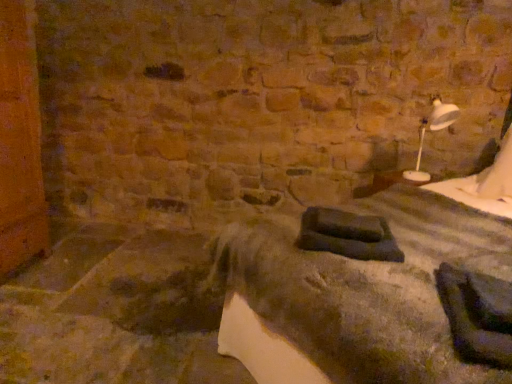
Locate an element on the screen. The height and width of the screenshot is (384, 512). dark gray fabric bed at center is located at coordinates (377, 287).

What do you see at coordinates (377, 287) in the screenshot? I see `dark gray fabric bed at center` at bounding box center [377, 287].

What do you see at coordinates (432, 130) in the screenshot?
I see `white plastic lamp at upper right` at bounding box center [432, 130].

Identify the location of white plastic lamp at upper right. This screenshot has width=512, height=384. (432, 130).

Where is `dark gray fabric bed at center`? The image size is (512, 384). dark gray fabric bed at center is located at coordinates (377, 287).

Is dark gray fabric bed at center at the left side of white plastic lamp at upper right?

Yes.

Between dark gray fabric bed at center and white plastic lamp at upper right, which one is positioned behind?

white plastic lamp at upper right is behind.

Which point is more distant from viewer, (x=274, y=305) or (x=443, y=128)?

The point (x=443, y=128) is farther from the camera.

From the image's perspective, which is above, dark gray fabric bed at center or white plastic lamp at upper right?

white plastic lamp at upper right, from the image's perspective.

From a real-world perspective, is dark gray fabric bed at center positioned under white plastic lamp at upper right based on gravity?

Yes, from a real-world perspective, dark gray fabric bed at center is beneath white plastic lamp at upper right.

Which object is wider, dark gray fabric bed at center or white plastic lamp at upper right?

dark gray fabric bed at center.

Is dark gray fabric bed at center taller or shorter than white plastic lamp at upper right?

In the image, dark gray fabric bed at center appears to be taller than white plastic lamp at upper right.

Which of these two, dark gray fabric bed at center or white plastic lamp at upper right, is bigger?

dark gray fabric bed at center is bigger.

Is dark gray fabric bed at center outside of white plastic lamp at upper right?

Yes.

Are dark gray fabric bed at center and white plastic lamp at upper right beside each other?

dark gray fabric bed at center and white plastic lamp at upper right are clearly separated.

Is dark gray fabric bed at center oriented towards white plastic lamp at upper right?

No.

How different are the orientations of dark gray fabric bed at center and white plastic lamp at upper right in degrees?

There is a 50-degree angle between the facing directions of dark gray fabric bed at center and white plastic lamp at upper right.

Find the location of a particular element. The height and width of the screenshot is (384, 512). bedside lamp that appears behind the dark gray fabric bed at center is located at coordinates (432, 130).

Considering the relative positions of white plastic lamp at upper right and dark gray fabric bed at center in the image provided, is white plastic lamp at upper right to the right of dark gray fabric bed at center from the viewer's perspective?

Correct, you'll find white plastic lamp at upper right to the right of dark gray fabric bed at center.

Which object is closer to the camera taking this photo, white plastic lamp at upper right or dark gray fabric bed at center?

dark gray fabric bed at center is closer to the camera.

Which is more distant, (405, 172) or (465, 256)?

The point (405, 172) is farther from the camera.

From the image's perspective, is white plastic lamp at upper right located above dark gray fabric bed at center?

Yes, from the image's perspective, white plastic lamp at upper right is above dark gray fabric bed at center.

From a real-world perspective, is white plastic lamp at upper right positioned above or below dark gray fabric bed at center?

In terms of real-world spatial position, white plastic lamp at upper right is above dark gray fabric bed at center.

Based on the photo, which of these two, white plastic lamp at upper right or dark gray fabric bed at center, is wider?

With larger width is dark gray fabric bed at center.

Between white plastic lamp at upper right and dark gray fabric bed at center, which one has more height?

With more height is dark gray fabric bed at center.

Between white plastic lamp at upper right and dark gray fabric bed at center, which one has smaller size?

Smaller between the two is white plastic lamp at upper right.

Do you think white plastic lamp at upper right is within dark gray fabric bed at center, or outside of it?

white plastic lamp at upper right is inside dark gray fabric bed at center.

Does white plastic lamp at upper right touch dark gray fabric bed at center?

No, white plastic lamp at upper right is not in contact with dark gray fabric bed at center.

Is white plastic lamp at upper right looking in the opposite direction of dark gray fabric bed at center?

Yes, white plastic lamp at upper right is positioned with its back facing dark gray fabric bed at center.

How different are the orientations of white plastic lamp at upper right and dark gray fabric bed at center in degrees?

The angle between the facing direction of white plastic lamp at upper right and the facing direction of dark gray fabric bed at center is 50 degrees.

How far apart are white plastic lamp at upper right and dark gray fabric bed at center?

white plastic lamp at upper right and dark gray fabric bed at center are 1.18 meters apart from each other.

Identify the location of bedside lamp above the dark gray fabric bed at center (from a real-world perspective). This screenshot has height=384, width=512. (432, 130).

Where is `bedside lamp above the dark gray fabric bed at center (from a real-world perspective)`? This screenshot has width=512, height=384. bedside lamp above the dark gray fabric bed at center (from a real-world perspective) is located at coordinates (432, 130).

At what (x,y) coordinates should I click in order to perform the action: click on bed in front of the white plastic lamp at upper right. Please return your answer as a coordinate pair (x, y). Image resolution: width=512 pixels, height=384 pixels. Looking at the image, I should click on (377, 287).